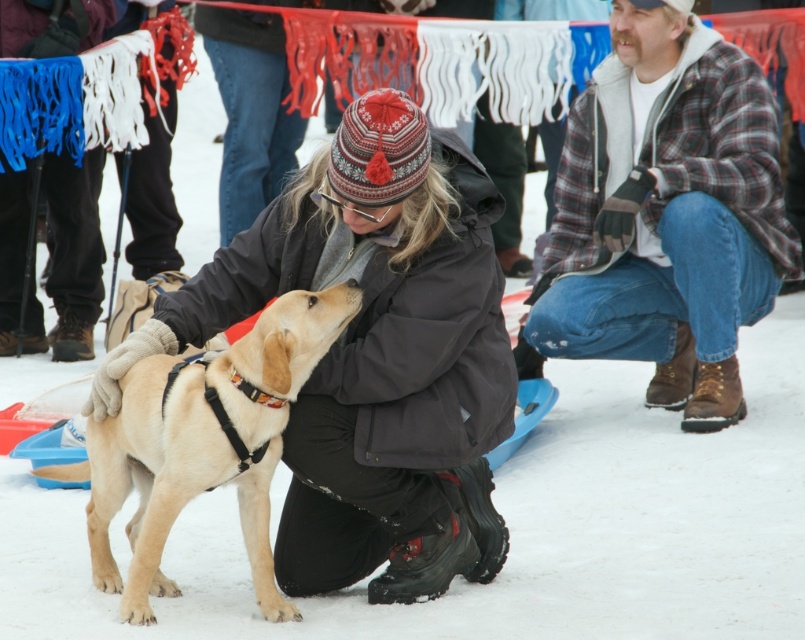
Question: Is plaid flannel shirt at lower right wider than light brown fur at center?

Choices:
 (A) no
 (B) yes

Answer: (B)

Question: Is matte black jacket at center closer to camera compared to light brown fur at center?

Choices:
 (A) no
 (B) yes

Answer: (B)

Question: Which object is the farthest from the plaid flannel shirt at lower right?

Choices:
 (A) matte black jacket at center
 (B) light brown fur at center

Answer: (B)

Question: Does matte black jacket at center appear over plaid flannel shirt at lower right?

Choices:
 (A) no
 (B) yes

Answer: (A)

Question: Which point is farther from the camera taking this photo?

Choices:
 (A) (380, 236)
 (B) (250, 502)
 (C) (611, 154)

Answer: (C)

Question: Which point is farther from the camera taking this photo?

Choices:
 (A) (126, 412)
 (B) (684, 200)
 (C) (444, 486)

Answer: (B)